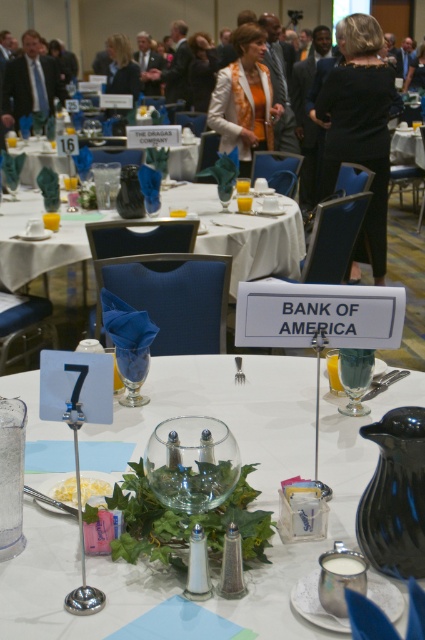
You are a photographer at this event and need to ensure all guests are visible in the group photo. Given that the matte black suit at upper left and the blonde hair at upper center are in the front row, which guest might be blocking the view of the other?

The matte black suit at upper left is much taller than the blonde hair at upper center, so the matte black suit at upper left might be blocking the view of the blonde hair at upper center.

You are a guest at the event and need to find your seat. You see the white glossy tablecloth at center and the blonde hair at upper center. Which object takes up more space in the image?

The blonde hair at upper center occupies more space than the white glossy tablecloth at center.